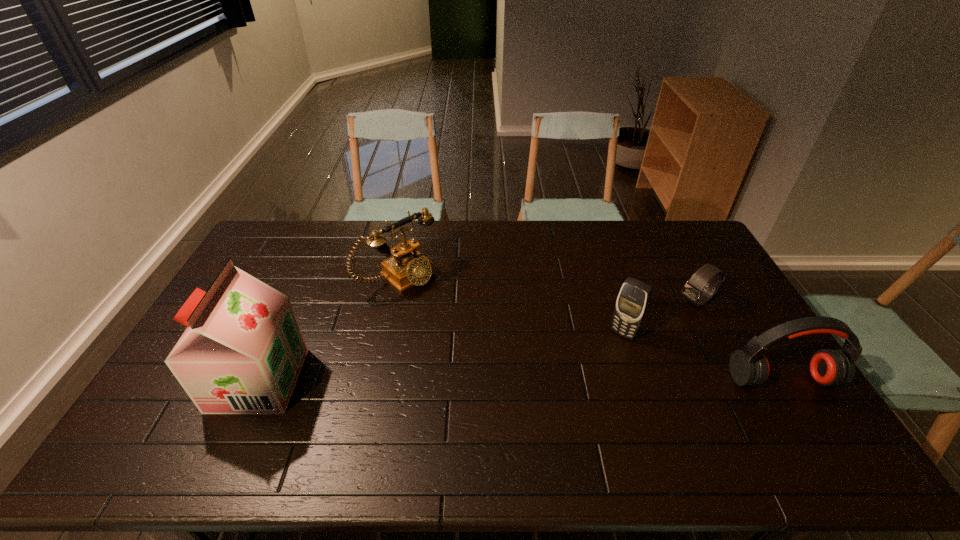
Find the location of `the tallest object`. the tallest object is located at coordinates (242, 352).

You are a GUI agent. You are given a task and a screenshot of the screen. Output one action in this format:
    pyautogui.click(x=<x>, y=<y>)
    Task: Click on the soya milk
    The height and width of the screenshot is (540, 960).
    Given the screenshot: What is the action you would take?
    pyautogui.click(x=242, y=352)

Identify the location of earphone. The width and height of the screenshot is (960, 540). (749, 367).

You are a GUI agent. You are given a task and a screenshot of the screen. Output one action in this format:
    pyautogui.click(x=<x>, y=<y>)
    Task: Click on the cellular telephone
    The width and height of the screenshot is (960, 540).
    Given the screenshot: What is the action you would take?
    pyautogui.click(x=633, y=300)

This screenshot has height=540, width=960. What are the coordinates of `the third object from right to left` in the screenshot? It's located at (633, 300).

Image resolution: width=960 pixels, height=540 pixels. I want to click on telephone, so click(406, 267).

Locate an element on the screen. The width and height of the screenshot is (960, 540). the shortest object is located at coordinates (693, 292).

This screenshot has width=960, height=540. I want to click on free space located with the cap open on the tallest object, so click(202, 380).

Image resolution: width=960 pixels, height=540 pixels. Identify the location of vacant space situated with the cap open on the tallest object. (173, 380).

Locate an element on the screen. The image size is (960, 540). vacant space situated with the cap open on the tallest object is located at coordinates (180, 380).